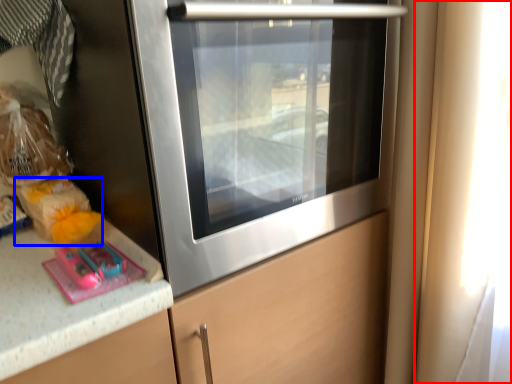
Question: Which object appears closest to the camera in this image, window (highlighted by a red box) or food (highlighted by a blue box)?

Choices:
 (A) window
 (B) food

Answer: (A)